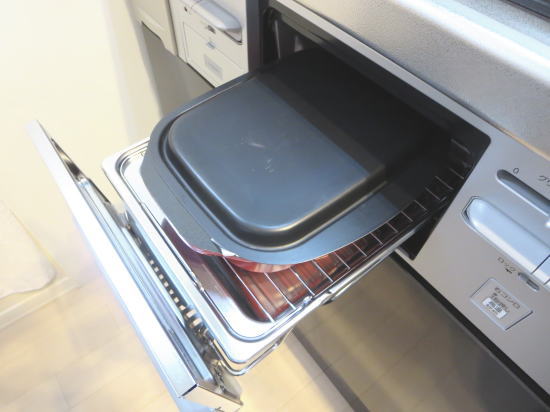
Identify the location of sink edge. (535, 6).